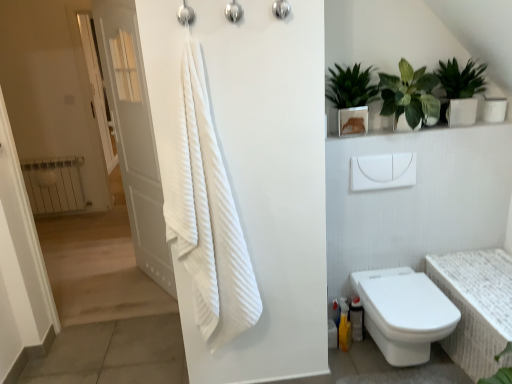
You are a GUI agent. You are given a task and a screenshot of the screen. Output one action in this format:
    pyautogui.click(x=<x>, y=<y>)
    Task: Click on the free spot to the right of white metallic radiator at left
    
    Given the screenshot: What is the action you would take?
    pyautogui.click(x=98, y=218)